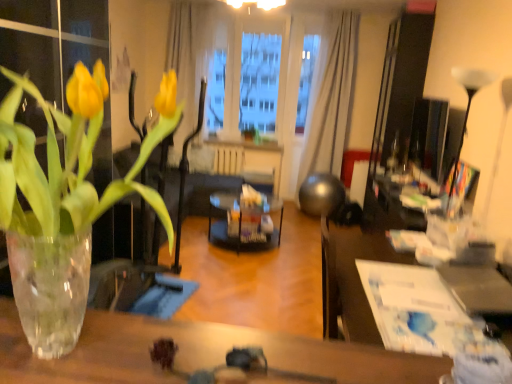
What do you see at coordinates (352, 280) in the screenshot? I see `white paper at center, which is counted as the 1th table, starting from the right` at bounding box center [352, 280].

Describe the element at coordinates (255, 78) in the screenshot. I see `transparent plastic window screen at center` at that location.

The width and height of the screenshot is (512, 384). Identify the location of white glossy lamp at upper right. (467, 107).

Which is farther, [305,153] or [245,111]?

The point [305,153] is farther.

Identify the location of window screen behind the white sheer curtain at upper center. This screenshot has height=384, width=512. (255, 78).

Is white sheer curtain at upper center wider than transparent plastic window screen at center?

Indeed, white sheer curtain at upper center has a greater width compared to transparent plastic window screen at center.

Is white sheer curtain at upper center placed right next to transparent plastic window screen at center?

They are not placed beside each other.

Based on the photo, from the image's perspective, is black glass table at center positioned above or below white paper at center, positioned as the 1th table in back-to-front order?

Clearly, from the image's perspective, black glass table at center is above white paper at center, positioned as the 1th table in back-to-front order.

Who is smaller, black glass table at center or white paper at center, arranged as the second table when viewed from the front?

With smaller size is white paper at center, arranged as the second table when viewed from the front.

From a real-world perspective, who is located higher, black glass table at center or white paper at center, which is counted as the 1th table, starting from the right?

In real-world perspective, white paper at center, which is counted as the 1th table, starting from the right, is above.

How many degrees apart are the facing directions of transparent glass table at lower center, the 1th table when ordered from front to back, and white paper at center, arranged as the second table when viewed from the left?

1.92 degrees separate the facing orientations of transparent glass table at lower center, the 1th table when ordered from front to back, and white paper at center, arranged as the second table when viewed from the left.

Is transparent glass table at lower center, which appears as the 1th table when viewed from the left, oriented away from white paper at center, positioned as the 1th table in back-to-front order?

transparent glass table at lower center, which appears as the 1th table when viewed from the left, does not have its back to white paper at center, positioned as the 1th table in back-to-front order.

Is transparent glass table at lower center, the 1th table when ordered from front to back, in front of or behind white paper at center, positioned as the 1th table in back-to-front order, in the image?

transparent glass table at lower center, the 1th table when ordered from front to back, is in front of white paper at center, positioned as the 1th table in back-to-front order.

Is transparent glass table at lower center, the 1th table when ordered from front to back, not near white paper at center, arranged as the second table when viewed from the front?

Indeed, transparent glass table at lower center, the 1th table when ordered from front to back, is not near white paper at center, arranged as the second table when viewed from the front.

Looking at this image, from a real-world perspective, is white paper at center, arranged as the second table when viewed from the front, positioned under transparent glass table at lower center, acting as the 2th table starting from the back, based on gravity?

Correct, in the physical world, white paper at center, arranged as the second table when viewed from the front, is lower than transparent glass table at lower center, acting as the 2th table starting from the back.

Which is behind, point (342, 305) or point (121, 333)?

The point (342, 305) is farther.

From the image's perspective, relative to transparent glass table at lower center, which appears as the 1th table when viewed from the left, is white paper at center, which is counted as the 1th table, starting from the right, above or below?

white paper at center, which is counted as the 1th table, starting from the right, is below transparent glass table at lower center, which appears as the 1th table when viewed from the left.

Considering the positions of points (105, 316) and (211, 236), is point (105, 316) farther from camera compared to point (211, 236)?

No.

From a real-world perspective, between transparent glass table at lower center, the 2th table from the right, and black glass table at center, who is vertically higher?

transparent glass table at lower center, the 2th table from the right, from a real-world perspective.

From the picture: Can you confirm if transparent glass table at lower center, the 1th table when ordered from front to back, is smaller than black glass table at center?

Indeed, transparent glass table at lower center, the 1th table when ordered from front to back, has a smaller size compared to black glass table at center.

From the image's perspective, is transparent plastic window screen at center located above white glossy lamp at upper right?

Yes, from the image's perspective, transparent plastic window screen at center is above white glossy lamp at upper right.

Does point (238, 91) lie in front of point (475, 74)?

No.

Which is more to the right, transparent plastic window screen at center or white glossy lamp at upper right?

Positioned to the right is white glossy lamp at upper right.

Which object is closer to the camera taking this photo, transparent plastic window screen at center or white glossy lamp at upper right?

white glossy lamp at upper right is closer to the camera.

Which of these two, black glass table at center or white sheer curtain at upper center, is wider?

black glass table at center is wider.

Which is more to the left, black glass table at center or white sheer curtain at upper center?

black glass table at center is more to the left.

Is black glass table at center positioned beyond the bounds of white sheer curtain at upper center?

black glass table at center is positioned outside white sheer curtain at upper center.

Where is `window screen on the left of white sheer curtain at upper center`? window screen on the left of white sheer curtain at upper center is located at coordinates (255, 78).

Identify the location of table that appears on the right of black glass table at center. The height and width of the screenshot is (384, 512). (352, 280).

Estimate the real-world distances between objects in this image. Which object is closer to white paper at center, positioned as the 1th table in back-to-front order, translucent glass vase at left or white glossy lamp at upper right?

white glossy lamp at upper right is closer to white paper at center, positioned as the 1th table in back-to-front order.

Based on their spatial positions, is transparent glass table at lower center, the 2th table from the right, or translucent glass vase at left further from white sheer curtain at upper center?

transparent glass table at lower center, the 2th table from the right, is positioned further to the anchor white sheer curtain at upper center.

When comparing their distances from transparent plastic window screen at center, does white glossy lamp at upper right or transparent glass table at lower center, acting as the 2th table starting from the back, seem closer?

The object closer to transparent plastic window screen at center is white glossy lamp at upper right.

Considering their positions, is white glossy lamp at upper right positioned closer to transparent plastic window screen at center than white sheer curtain at upper center?

Based on the image, white sheer curtain at upper center appears to be nearer to transparent plastic window screen at center.

When comparing their distances from white paper at center, which is counted as the 1th table, starting from the right, does white sheer curtain at upper center or black glass table at center seem further?

The object further to white paper at center, which is counted as the 1th table, starting from the right, is white sheer curtain at upper center.

From the image, which object appears to be nearer to white paper at center, which is counted as the 1th table, starting from the right, white sheer curtain at upper center or transparent plastic window screen at center?

white sheer curtain at upper center is closer to white paper at center, which is counted as the 1th table, starting from the right.

Based on their spatial positions, is white sheer curtain at upper center or black glass table at center further from translucent glass vase at left?

The object further to translucent glass vase at left is white sheer curtain at upper center.

Based on their spatial positions, is transparent plastic window screen at center or white glossy lamp at upper right closer to white sheer curtain at upper center?

transparent plastic window screen at center is closer to white sheer curtain at upper center.

Image resolution: width=512 pixels, height=384 pixels. Identify the location of lamp located between translucent glass vase at left and white sheer curtain at upper center in the depth direction. (467, 107).

Find the location of a particular element. lamp between translucent glass vase at left and black glass table at center along the z-axis is located at coordinates (467, 107).

Find the location of `glass table between white paper at center, which is counted as the 1th table, starting from the right, and white sheer curtain at upper center, along the z-axis`. glass table between white paper at center, which is counted as the 1th table, starting from the right, and white sheer curtain at upper center, along the z-axis is located at coordinates (242, 222).

You are a GUI agent. You are given a task and a screenshot of the screen. Output one action in this format:
    pyautogui.click(x=<x>, y=<y>)
    Task: Click on the curtain between white glossy lamp at upper right and transparent plastic window screen at center along the z-axis
    This screenshot has height=384, width=512.
    Given the screenshot: What is the action you would take?
    pyautogui.click(x=330, y=99)